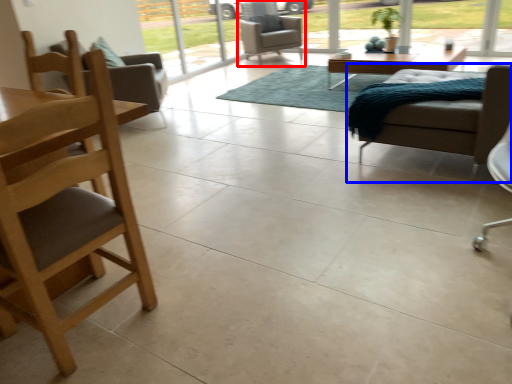
Question: Which object appears closest to the camera in this image, chair (highlighted by a red box) or chair (highlighted by a blue box)?

Choices:
 (A) chair
 (B) chair

Answer: (B)